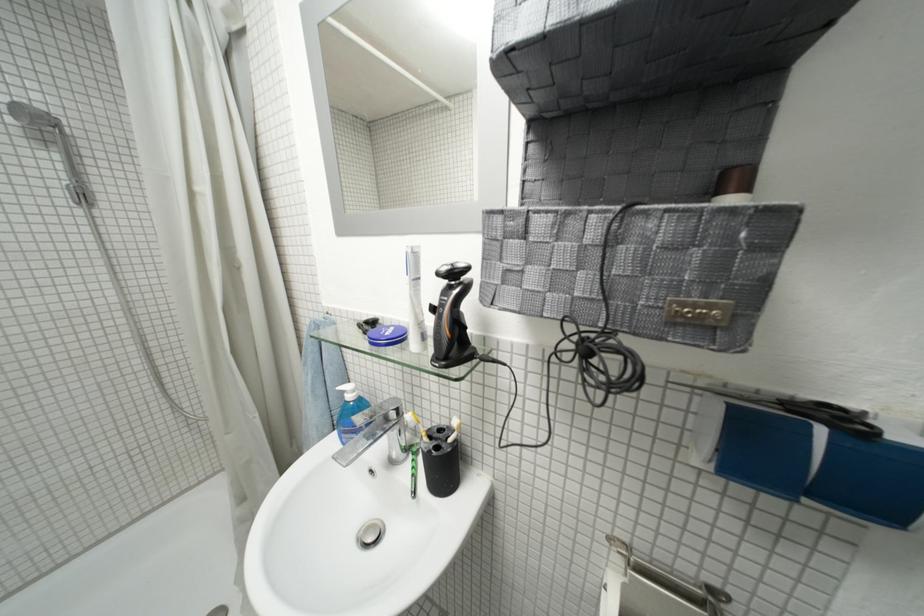
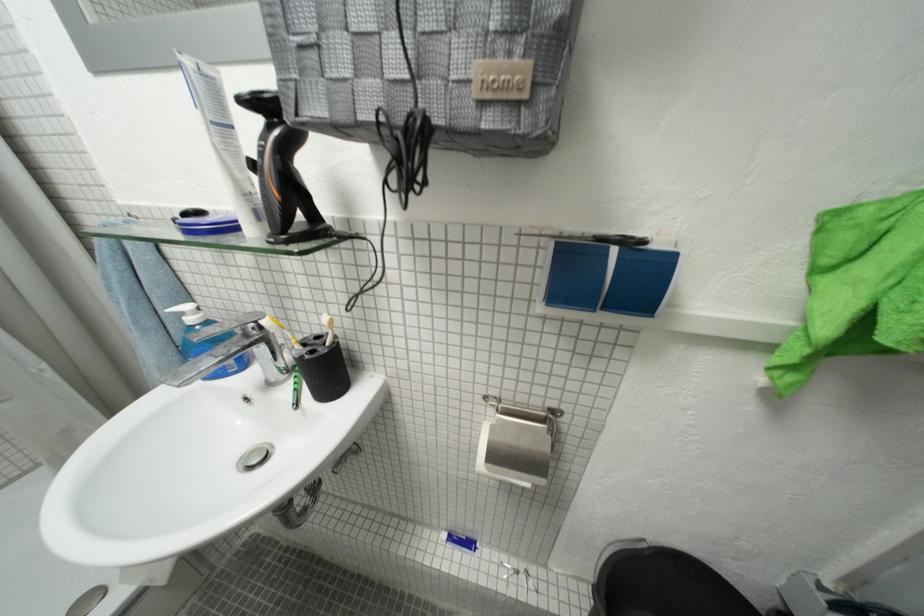
Where in the second image is the point corresponding to (x=699, y=419) from the first image?

(546, 273)